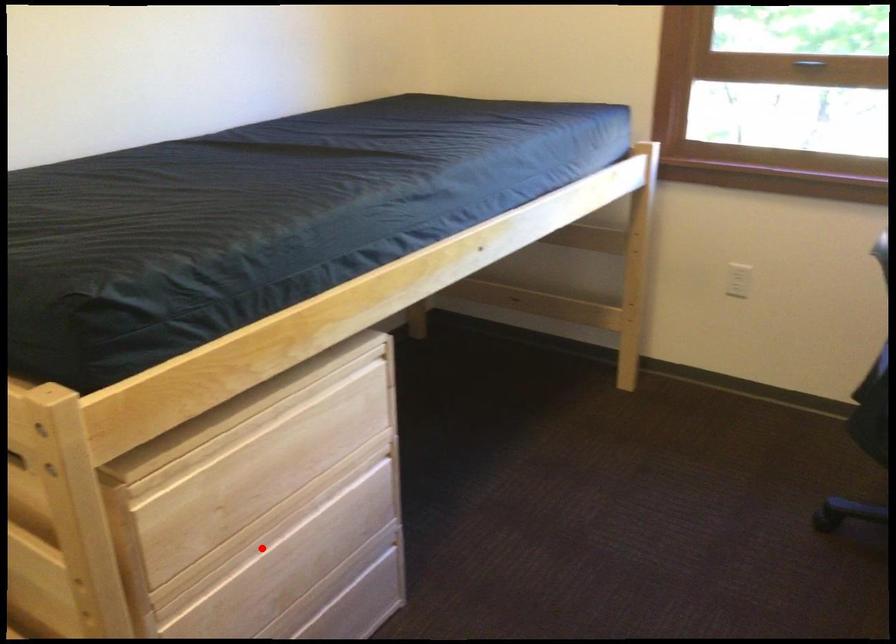
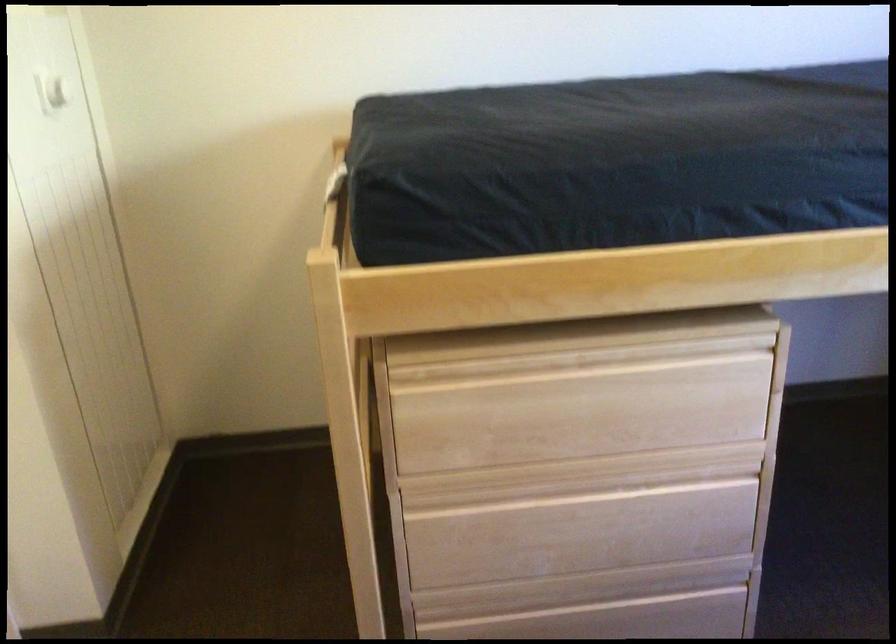
In the second image, find the point that corresponds to the highlighted location in the first image.

(546, 491)